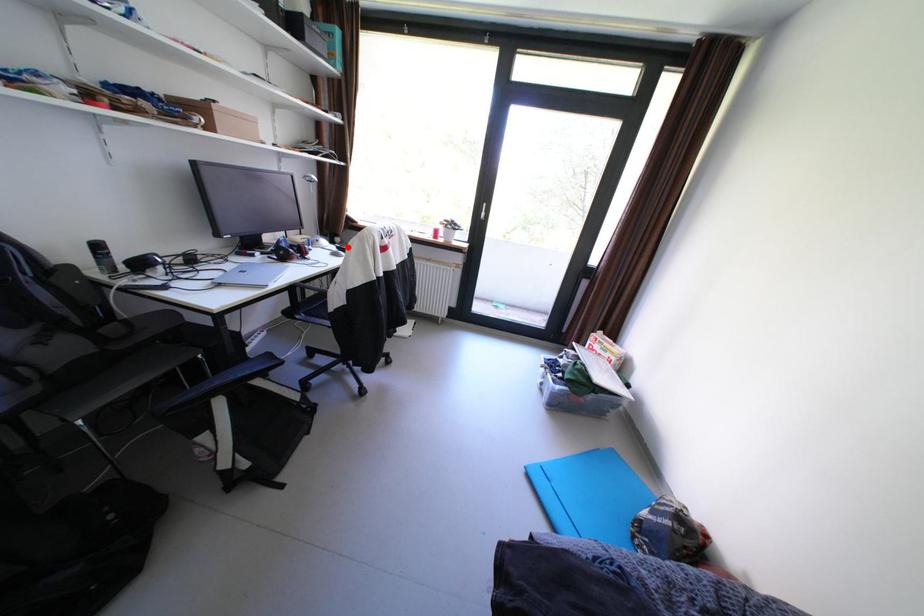
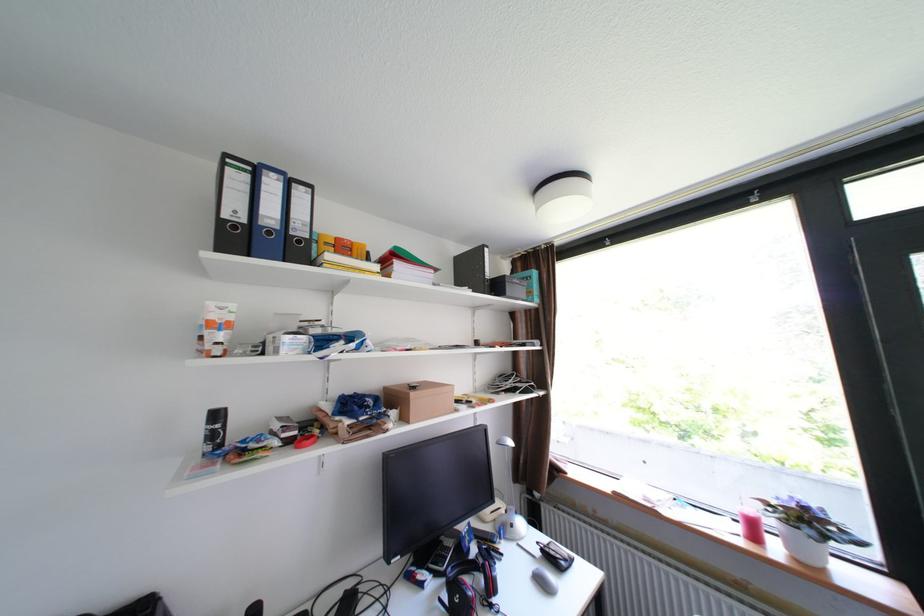
The point at the highlighted location is marked in the first image. Where is the corresponding point in the second image?

(553, 551)